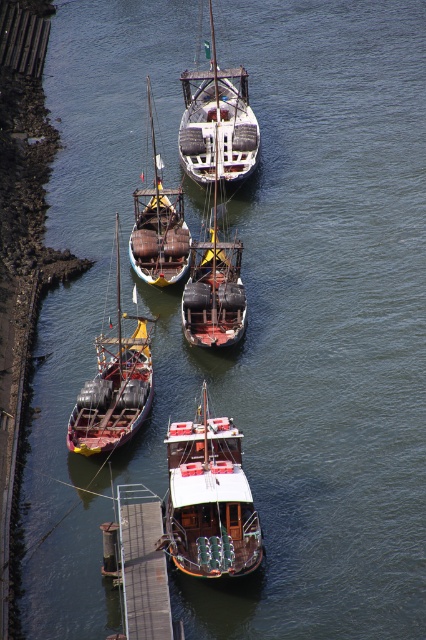
You are a sailor planning to board a boat. You see the white matte sailboat at center and the rusty wooden boat at center. Which boat is located higher in the image?

The white matte sailboat at center is positioned over the rusty wooden boat at center, so it is higher in the image.

You are standing on the rocky shoreline and want to board the white matte sailboat at center. Can you walk directly to it from your current position?

The white matte sailboat at center is 63.99 meters away from viewer, so you cannot walk directly to it from your current position as it is too far.

You are standing on the rocky shoreline looking at the boats. Which of the two points, point (112, 417) or point (157, 547), is closer to your viewpoint?

Point (112, 417) is closer to your viewpoint because it is further to the camera than point (157, 547).